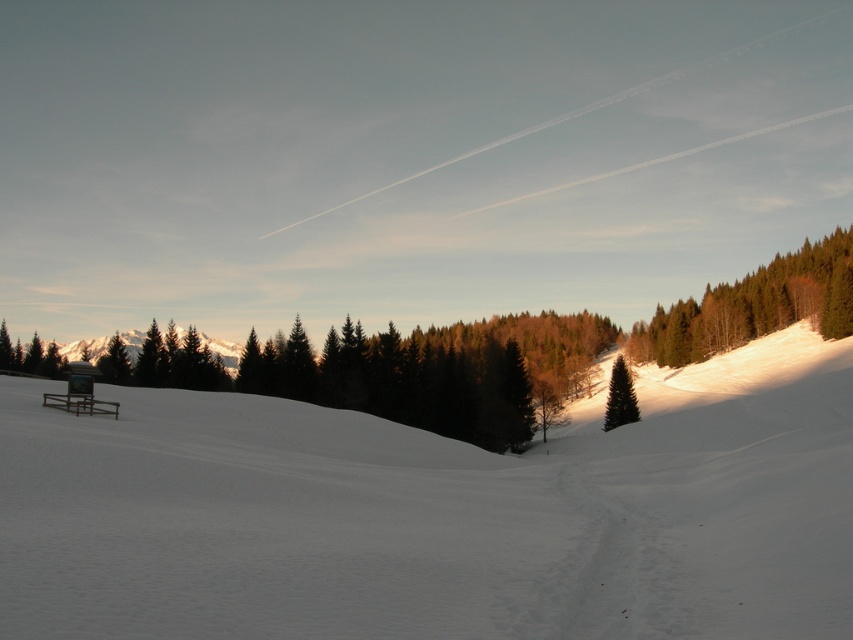
Does white snow at center come behind green matte tree at upper right?

No, white snow at center is in front of green matte tree at upper right.

Between white snow at center and green matte tree at upper right, which one has less height?

Standing shorter between the two is white snow at center.

Identify the location of white snow at center. Image resolution: width=853 pixels, height=640 pixels. (439, 513).

Where is `white snow at center`? The image size is (853, 640). white snow at center is located at coordinates (439, 513).

Between white snow at center and green matte tree at right, which one appears on the right side from the viewer's perspective?

green matte tree at right

From the picture: Is white snow at center wider than green matte tree at right?

Indeed, white snow at center has a greater width compared to green matte tree at right.

Is point (242, 413) positioned before point (611, 428)?

Yes, point (242, 413) is closer to viewer.

Find the location of a particular element. The height and width of the screenshot is (640, 853). white snow at center is located at coordinates (439, 513).

Does green matte tree at upper right appear on the left side of green matte tree at right?

No, green matte tree at upper right is not to the left of green matte tree at right.

Is green matte tree at upper right taller than green matte tree at right?

Yes, green matte tree at upper right is taller than green matte tree at right.

Locate an element on the screen. This screenshot has width=853, height=640. green matte tree at upper right is located at coordinates (753, 305).